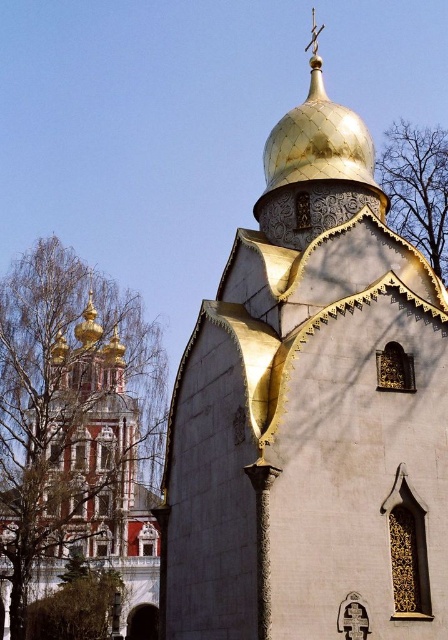
Looking at this image, you are standing in front of the golden dome building and want to take a photo. There are two points marked in the scene, point 1 at coordinates point (409,512) and point 2 at coordinates point (147,589). Which point is closer to your camera lens?

Point (409,512) is closer to the camera than point (147,589).